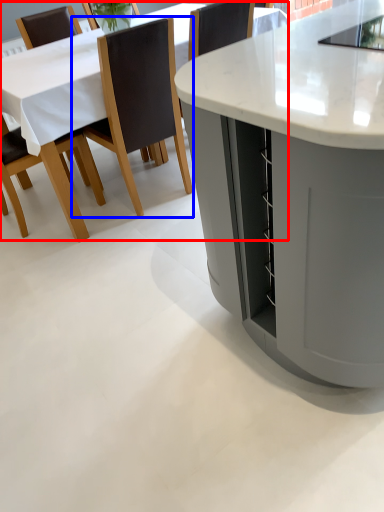
Question: Among these objects, which one is nearest to the camera, table (highlighted by a red box) or chair (highlighted by a blue box)?

Choices:
 (A) table
 (B) chair

Answer: (B)